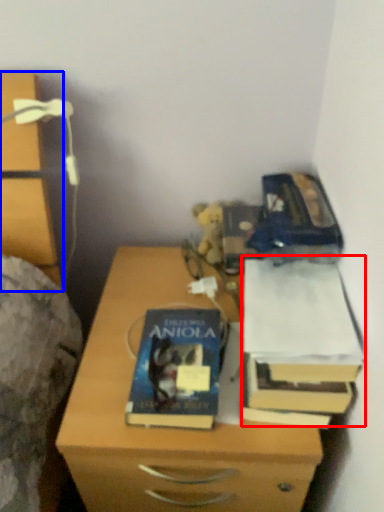
Question: Which object is further to the camera taking this photo, paperback book (highlighted by a red box) or chest of drawers (highlighted by a blue box)?

Choices:
 (A) paperback book
 (B) chest of drawers

Answer: (A)